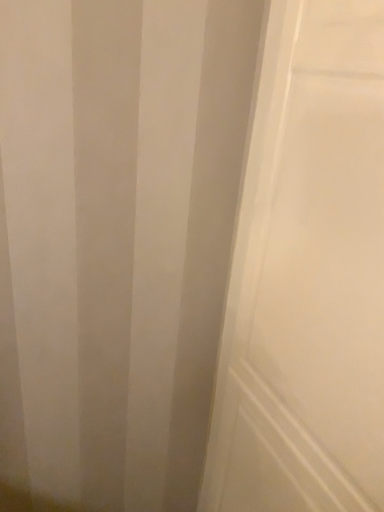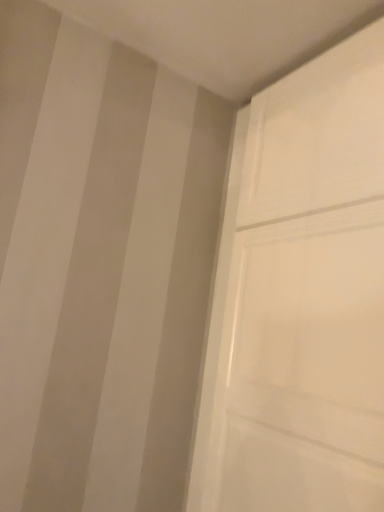
Question: How did the camera likely rotate when shooting the video?

Choices:
 (A) rotated left
 (B) rotated right

Answer: (B)